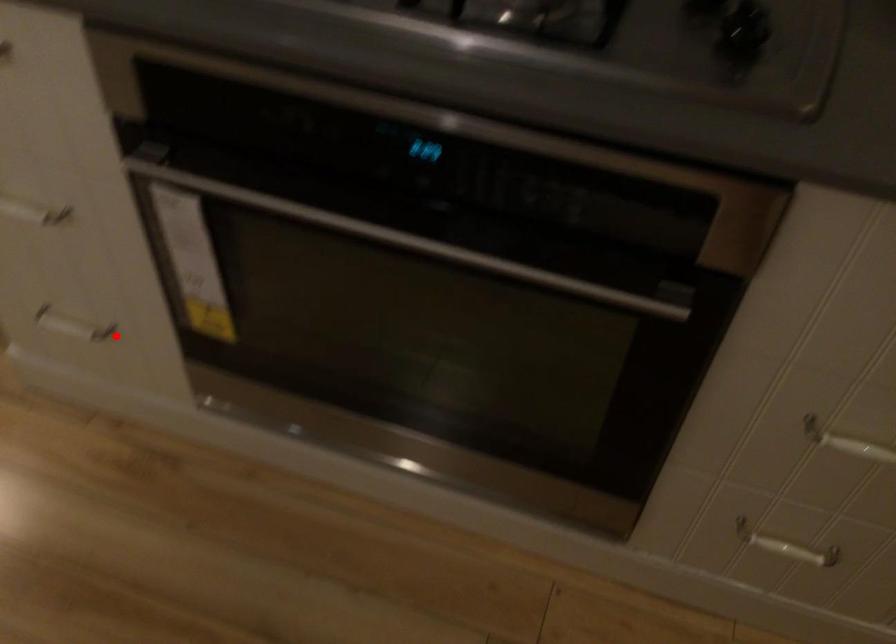
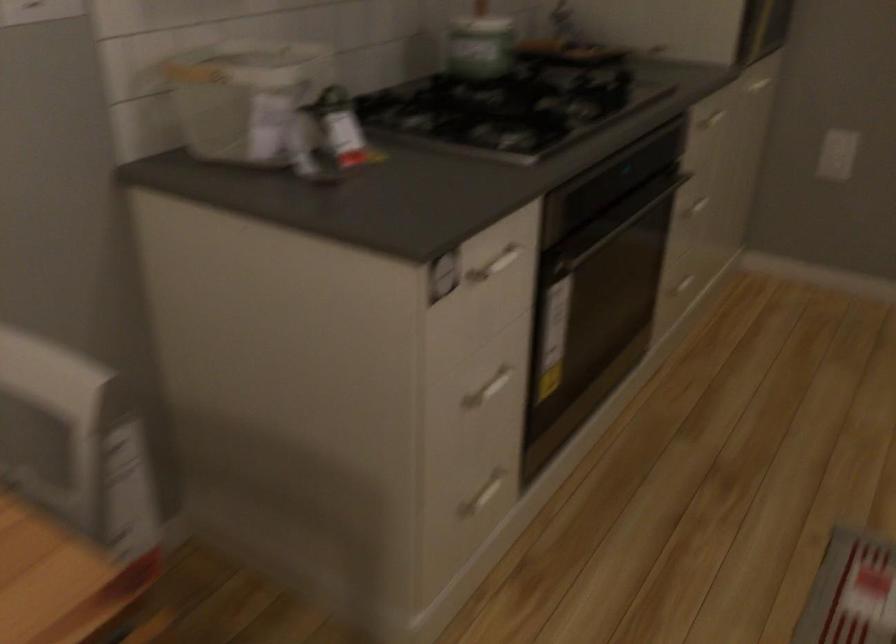
Question: A red point is marked in image1. In image2, is the corresponding 3D point closer to the camera or farther? Reply with the corresponding letter.

Choices:
 (A) The corresponding 3D point is closer.
 (B) The corresponding 3D point is farther.

Answer: (B)